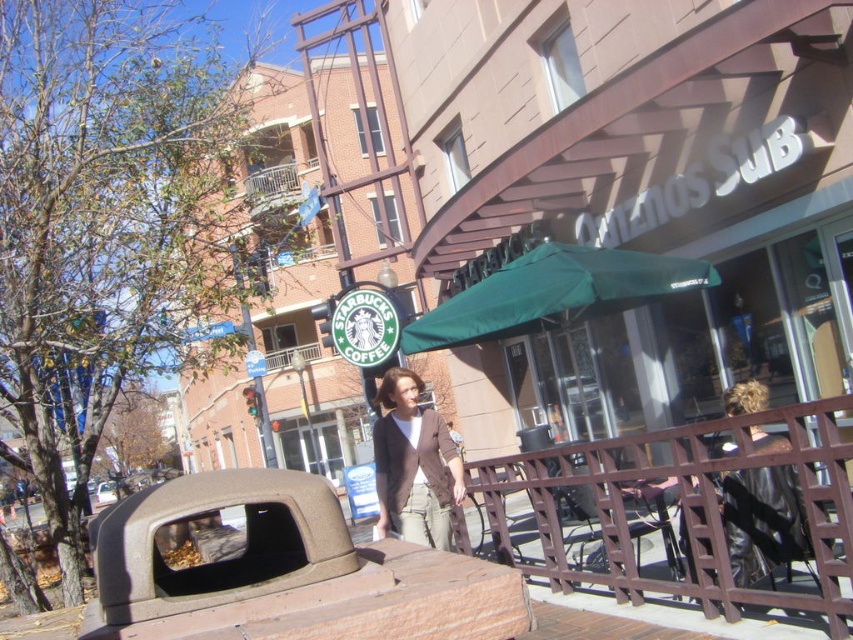
You are standing at the Starbucks storefront and want to place a new bench exactly at the point marked by the coordinates point (553,292). What object will the bench be placed under?

The bench placed at point (553,292) will be under the green fabric umbrella at center, as the coordinates mark its location.

You are a fashion designer observing the urban scene. You notice the khaki cotton pants at center and the shiny black jacket at upper right. Which item of clothing appears bigger in the image?

The khaki cotton pants at center is larger in size than the shiny black jacket at upper right, so the khaki cotton pants at center appears bigger in the image.